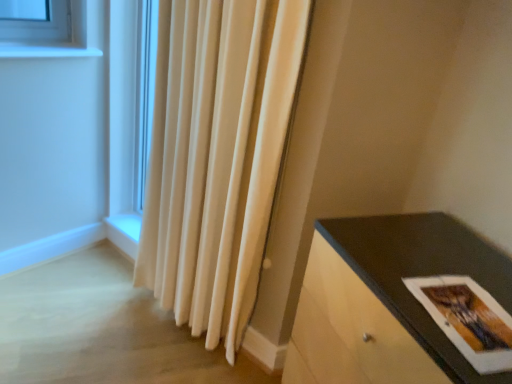
Question: Is point (474, 360) positioned closer to the camera than point (243, 114)?

Choices:
 (A) farther
 (B) closer

Answer: (B)

Question: Considering the positions of matte paper postcard at lower right and white velvet curtain at center in the image, is matte paper postcard at lower right wider or thinner than white velvet curtain at center?

Choices:
 (A) wide
 (B) thin

Answer: (A)

Question: Considering the real-world distances, which object is closest to the white velvet curtain at center?

Choices:
 (A) matte black table at lower right
 (B) matte paper postcard at lower right

Answer: (A)

Question: Estimate the real-world distances between objects in this image. Which object is farther from the matte black table at lower right?

Choices:
 (A) white velvet curtain at center
 (B) matte paper postcard at lower right

Answer: (A)